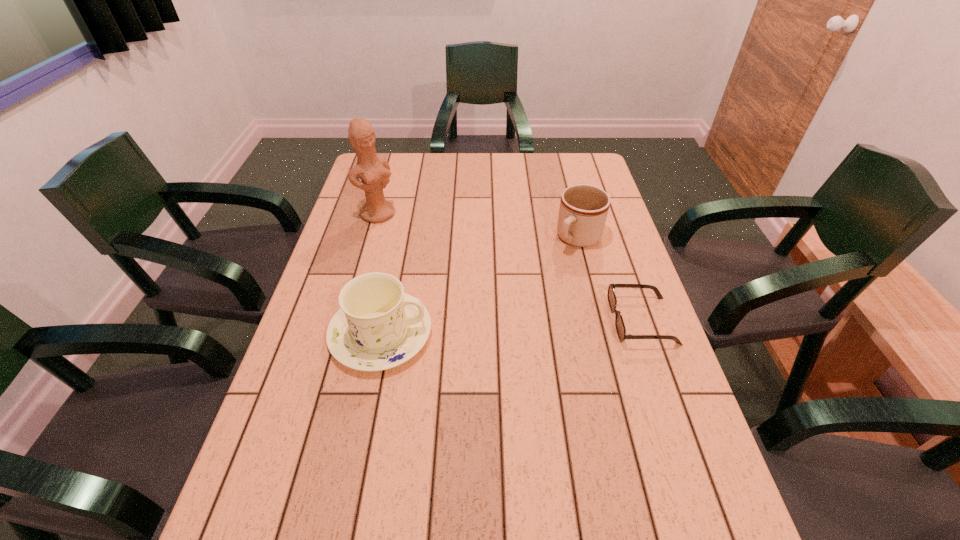
Identify the location of free space between the tallest object and the sunglasses. (510, 267).

Find the location of a particular element. This screenshot has height=540, width=960. object that is the third closest to the mug is located at coordinates (374, 172).

The width and height of the screenshot is (960, 540). What are the coordinates of `object that is the closest one to the sunglasses` in the screenshot? It's located at (583, 210).

Where is `vacant space that satisfies the following two spatial constraints: 1. on the front side of the figurine; 2. on the left side of the mug`? The height and width of the screenshot is (540, 960). vacant space that satisfies the following two spatial constraints: 1. on the front side of the figurine; 2. on the left side of the mug is located at coordinates (372, 238).

Image resolution: width=960 pixels, height=540 pixels. I want to click on free point that satisfies the following two spatial constraints: 1. on the front side of the tallest object; 2. on the front-facing side of the sunglasses, so click(x=348, y=321).

Where is `vacant region that satisfies the following two spatial constraints: 1. on the front side of the tallest object; 2. on the right side of the mug`? The width and height of the screenshot is (960, 540). vacant region that satisfies the following two spatial constraints: 1. on the front side of the tallest object; 2. on the right side of the mug is located at coordinates pyautogui.click(x=372, y=238).